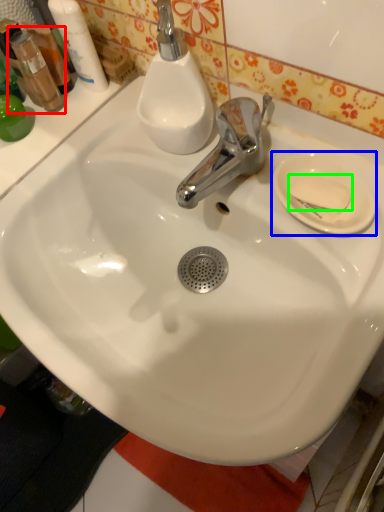
Question: Estimate the real-world distances between objects in this image. Which object is farther from mouthwash (highlighted by a red box), plate (highlighted by a blue box) or soap (highlighted by a green box)?

Choices:
 (A) plate
 (B) soap

Answer: (B)